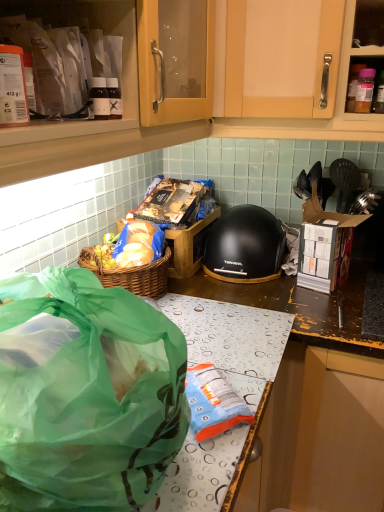
Question: From a real-world perspective, is matte plastic container at upper left on top of black matte helmet at center?

Choices:
 (A) yes
 (B) no

Answer: (A)

Question: Are matte plastic container at upper left and black matte helmet at center located far from each other?

Choices:
 (A) no
 (B) yes

Answer: (A)

Question: Can you confirm if matte plastic container at upper left is shorter than black matte helmet at center?

Choices:
 (A) no
 (B) yes

Answer: (B)

Question: From the image's perspective, is matte plastic container at upper left on black matte helmet at center?

Choices:
 (A) yes
 (B) no

Answer: (A)

Question: Is matte plastic container at upper left oriented towards black matte helmet at center?

Choices:
 (A) no
 (B) yes

Answer: (A)

Question: Is point tap(115, 123) closer or farther from the camera than point tap(226, 211)?

Choices:
 (A) farther
 (B) closer

Answer: (B)

Question: From the image's perspective, is matte plastic container at upper left above or below black matte helmet at center?

Choices:
 (A) above
 (B) below

Answer: (A)

Question: In terms of size, does matte plastic container at upper left appear bigger or smaller than black matte helmet at center?

Choices:
 (A) small
 (B) big

Answer: (A)

Question: Considering the relative positions of matte plastic container at upper left and black matte helmet at center in the image provided, is matte plastic container at upper left to the left or to the right of black matte helmet at center?

Choices:
 (A) left
 (B) right

Answer: (A)

Question: Is green translucent bag at lower left wider or thinner than matte plastic container at upper left?

Choices:
 (A) thin
 (B) wide

Answer: (B)

Question: Does point (54, 343) appear closer or farther from the camera than point (89, 16)?

Choices:
 (A) closer
 (B) farther

Answer: (A)

Question: Is green translucent bag at lower left spatially inside matte plastic container at upper left, or outside of it?

Choices:
 (A) inside
 (B) outside

Answer: (B)

Question: Is green translucent bag at lower left bigger or smaller than matte plastic container at upper left?

Choices:
 (A) big
 (B) small

Answer: (A)

Question: Based on their sizes in the image, would you say black matte helmet at center is bigger or smaller than green translucent bag at lower left?

Choices:
 (A) big
 (B) small

Answer: (B)

Question: From a real-world perspective, is black matte helmet at center positioned above or below green translucent bag at lower left?

Choices:
 (A) below
 (B) above

Answer: (A)